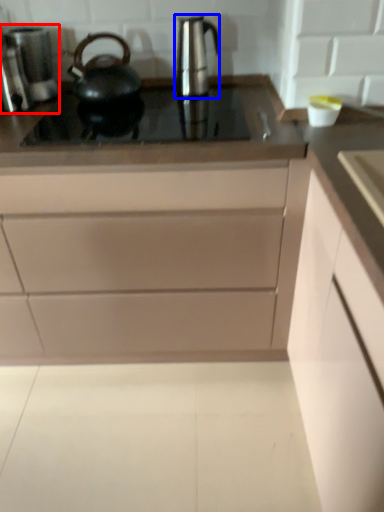
Question: Which of the following is the closest to the observer, coffee machine (highlighted by a red box) or kitchen appliance (highlighted by a blue box)?

Choices:
 (A) coffee machine
 (B) kitchen appliance

Answer: (B)